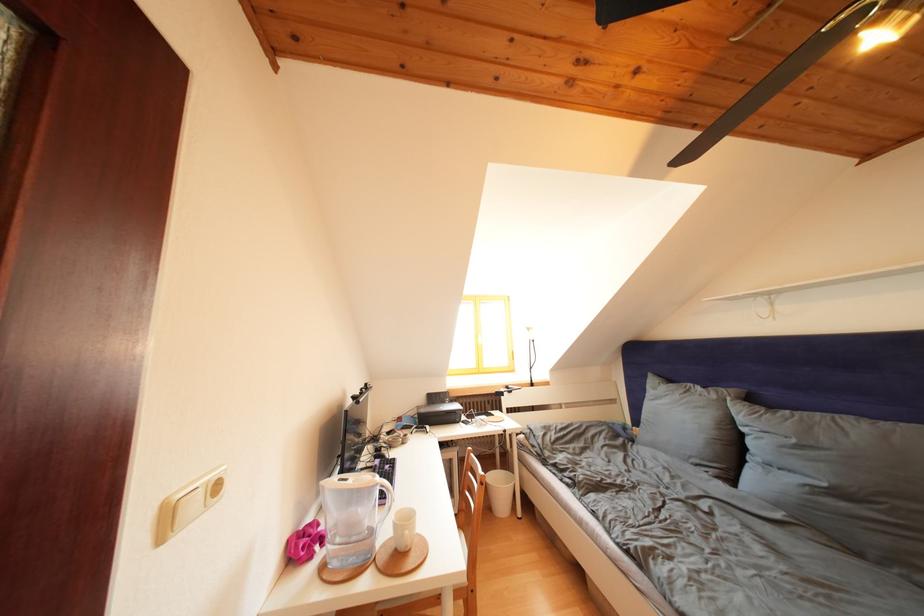
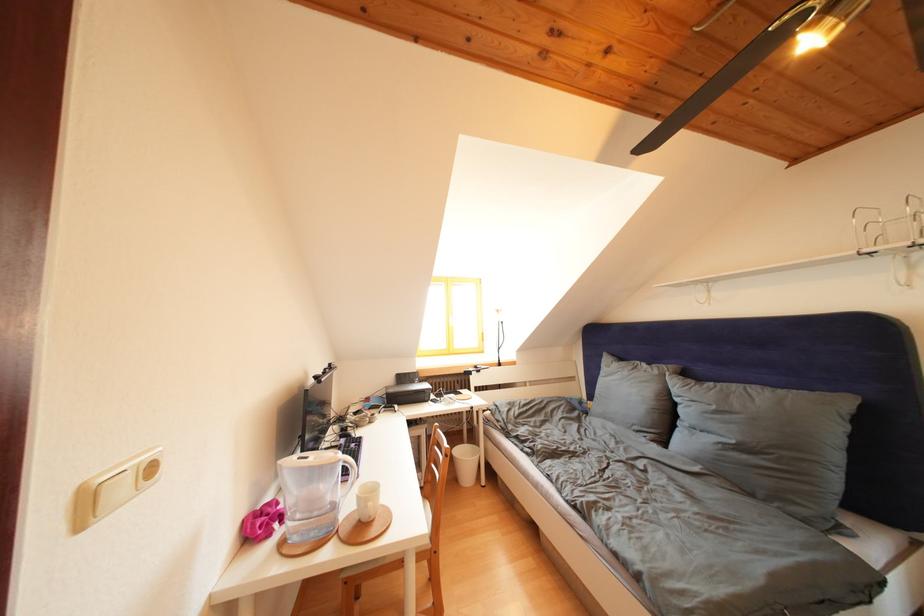
Question: What movement of the cameraman would produce the second image?

Choices:
 (A) Left
 (B) Right
 (C) Forward
 (D) Backward

Answer: (B)